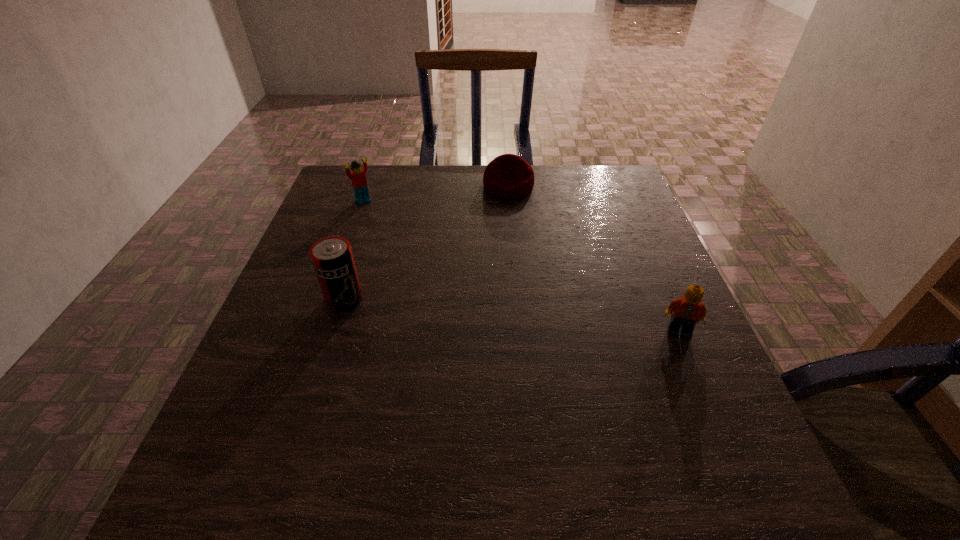
Identify the location of free space between the tallest object and the farther Lego. The height and width of the screenshot is (540, 960). (354, 250).

Locate an element on the screen. The image size is (960, 540). free space between the can and the shortest object is located at coordinates (426, 243).

The width and height of the screenshot is (960, 540). What are the coordinates of `empty location between the tallest object and the nearer Lego` in the screenshot? It's located at (512, 315).

Identify the location of vacant area that lies between the can and the nearer Lego. The width and height of the screenshot is (960, 540). (512, 315).

This screenshot has width=960, height=540. In order to click on vacant space in between the farther Lego and the rightmost object in this screenshot , I will do `click(521, 266)`.

What are the coordinates of `empty location between the nearest object and the second object from right to left` in the screenshot? It's located at (593, 259).

You are a GUI agent. You are given a task and a screenshot of the screen. Output one action in this format:
    pyautogui.click(x=<x>, y=<y>)
    Task: Click on the free point between the can and the farther Lego
    The width and height of the screenshot is (960, 540).
    Given the screenshot: What is the action you would take?
    pyautogui.click(x=354, y=250)

Find the location of a particular element. The height and width of the screenshot is (540, 960). object identified as the third closest to the tallest object is located at coordinates (688, 310).

Find the location of a particular element. object that stands as the closest to the tallest object is located at coordinates (358, 178).

Locate an element on the screen. This screenshot has height=540, width=960. blank space that satisfies the following two spatial constraints: 1. on the back side of the beanbag; 2. on the left side of the farther Lego is located at coordinates (369, 186).